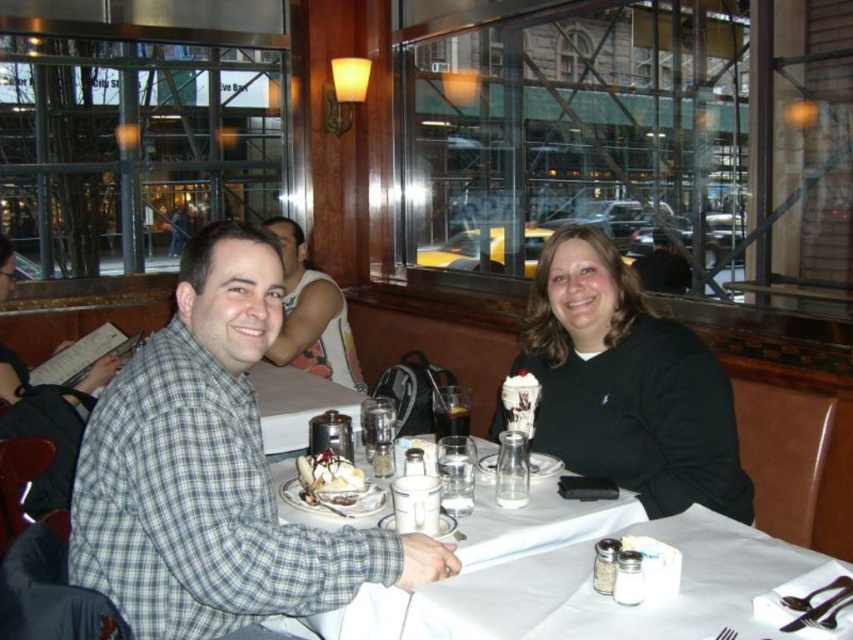
Measure the distance between plaid shirt at center and whipped cream topped sundae at center.

The distance of plaid shirt at center from whipped cream topped sundae at center is 42.00 centimeters.

Is plaid shirt at center behind whipped cream topped sundae at center?

No, it is not.

Who is more forward, (189, 365) or (343, 467)?

Point (189, 365) is more forward.

The height and width of the screenshot is (640, 853). Identify the location of plaid shirt at center. (212, 472).

Measure the distance between plaid shirt at center and black matte sweater at center.

plaid shirt at center and black matte sweater at center are 35.73 inches apart.

Is plaid shirt at center to the left of black matte sweater at center from the viewer's perspective?

Indeed, plaid shirt at center is positioned on the left side of black matte sweater at center.

Does point (154, 540) lie in front of point (608, 330)?

Yes, it is in front of point (608, 330).

Locate an element on the screen. The height and width of the screenshot is (640, 853). plaid shirt at center is located at coordinates (212, 472).

Can you confirm if black matte sweater at center is wider than plaid shirt at left?

Yes, black matte sweater at center is wider than plaid shirt at left.

Can you confirm if black matte sweater at center is taller than plaid shirt at left?

Yes.

The image size is (853, 640). What are the coordinates of `black matte sweater at center` in the screenshot? It's located at (627, 385).